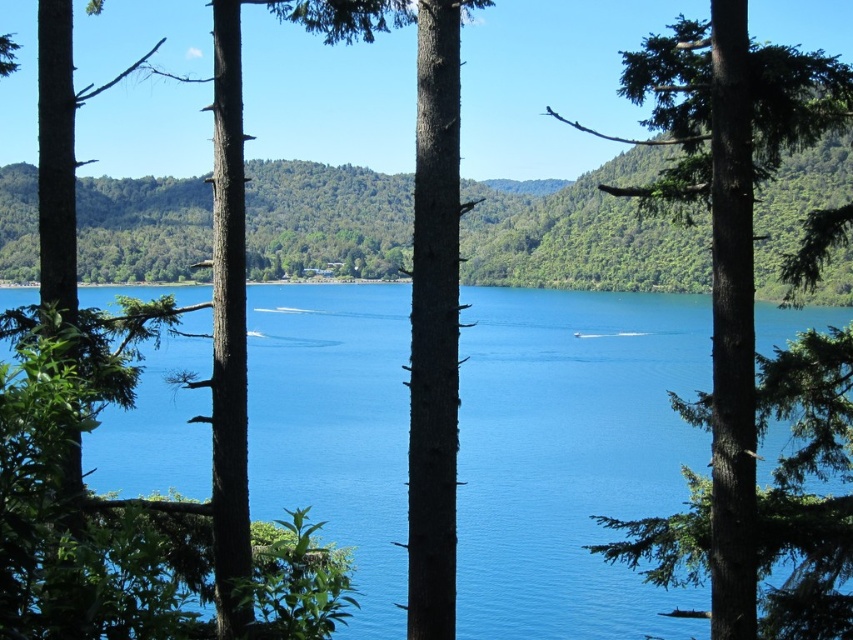
Question: Where is blue water at center located in relation to green textured tree at right in the image?

Choices:
 (A) left
 (B) right

Answer: (A)

Question: Is blue water at center closer to camera compared to green textured tree at right?

Choices:
 (A) no
 (B) yes

Answer: (A)

Question: Can you confirm if blue water at center is thinner than green textured tree at right?

Choices:
 (A) yes
 (B) no

Answer: (B)